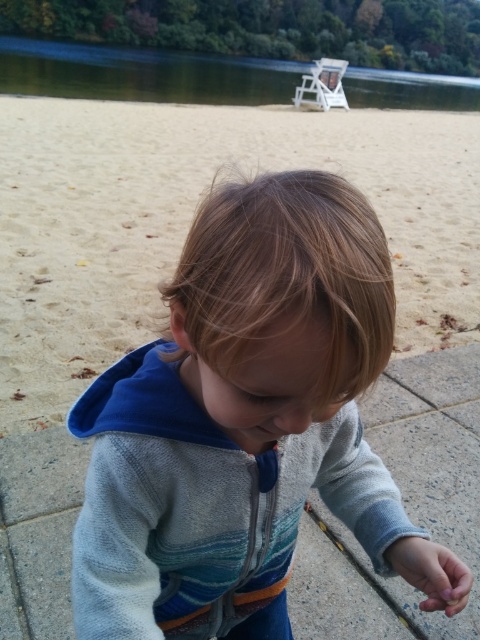
You are a photographer trying to capture the entire scene in one shot. Given that the sandy at lower center and the white plastic chair at upper center are both in your frame, which one should you focus on to ensure the other remains in the background?

The sandy at lower center is bigger than the white plastic chair at upper center, so focusing on the sandy at lower center will keep the white plastic chair at upper center in the background.

You are a photographer taking a picture of the beach scene. You notice two points marked in the image. The first point is at coordinate point (58, 220) and the second is at coordinate point (312, 74). Which point is closer to your camera lens?

Point (58, 220) is closer to the camera than point (312, 74).